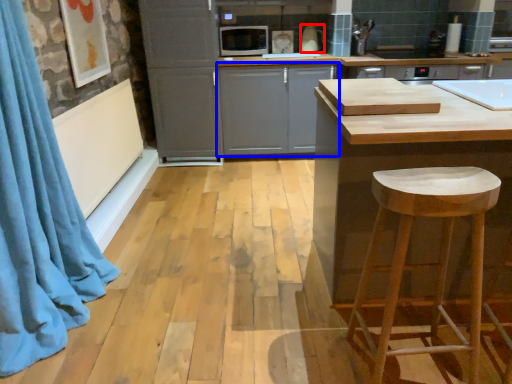
Question: Which object appears farthest to the camera in this image, appliance (highlighted by a red box) or cabinetry (highlighted by a blue box)?

Choices:
 (A) appliance
 (B) cabinetry

Answer: (A)